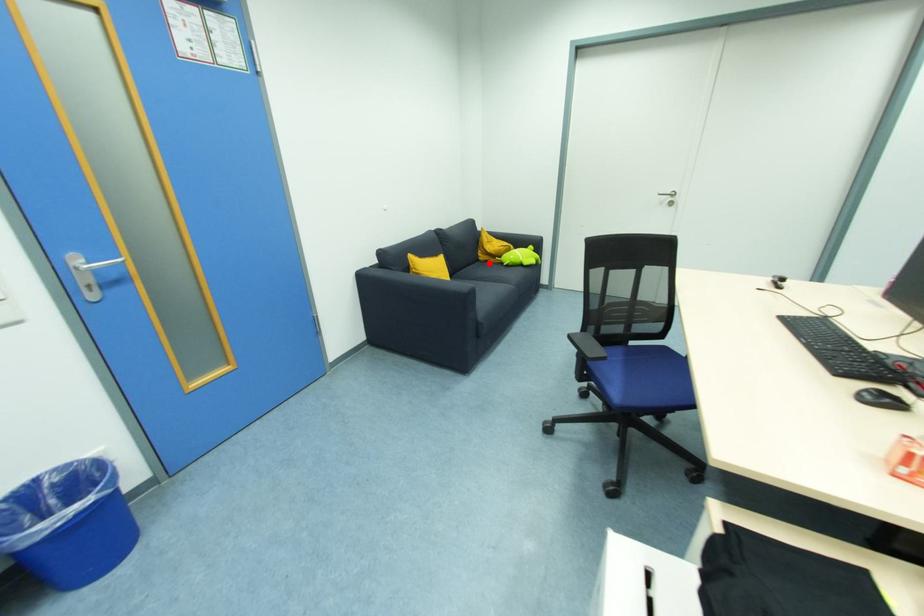
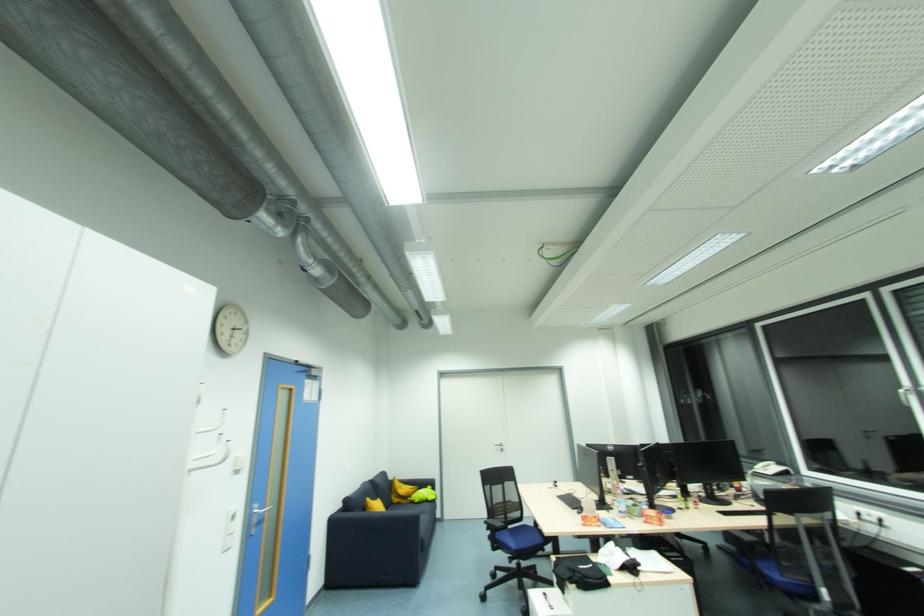
Question: A red point is marked in image1. In image2, is the corresponding 3D point closer to the camera or farther? Reply with the corresponding letter.

Choices:
 (A) The corresponding 3D point is closer.
 (B) The corresponding 3D point is farther.

Answer: (B)